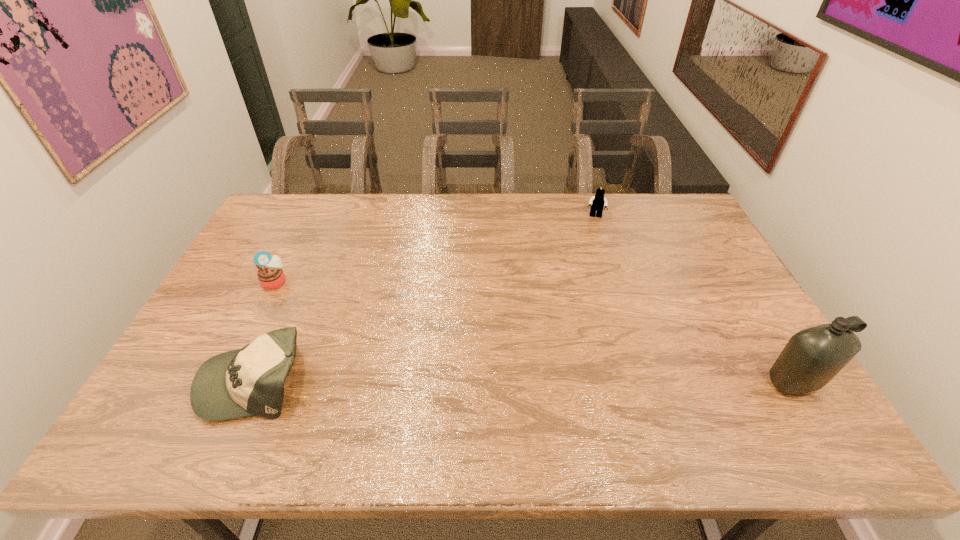
Locate an element on the screen. vacant point located between the second farthest object and the Lego is located at coordinates (435, 249).

Where is `unoccupied position between the third nearest object and the farthest object`? The image size is (960, 540). unoccupied position between the third nearest object and the farthest object is located at coordinates (435, 249).

This screenshot has height=540, width=960. Find the location of `free spot between the third object from left to right and the third nearest object`. free spot between the third object from left to right and the third nearest object is located at coordinates (435, 249).

Find the location of a particular element. empty space that is in between the third object from left to right and the bottle is located at coordinates (695, 299).

You are a GUI agent. You are given a task and a screenshot of the screen. Output one action in this format:
    pyautogui.click(x=<x>, y=<y>)
    Task: Click on the blank region between the Lego and the tallest object
    
    Given the screenshot: What is the action you would take?
    pyautogui.click(x=695, y=299)

I want to click on vacant space in between the baseball cap and the farthest object, so click(425, 298).

Where is `free space that is in between the Lego and the baseball cap`? free space that is in between the Lego and the baseball cap is located at coordinates (425, 298).

Where is `object that can be found as the closest to the rightmost object`? object that can be found as the closest to the rightmost object is located at coordinates (597, 202).

Identify which object is the third closest to the farthest object. Please provide its 2D coordinates. Your answer should be formatted as a tuple, i.e. [(x, y)], where the tuple contains the x and y coordinates of a point satisfying the conditions above.

[(270, 274)]

The image size is (960, 540). Identify the location of free space in the image that satisfies the following two spatial constraints: 1. on the back side of the muffin; 2. on the left side of the second object from right to left. (306, 217).